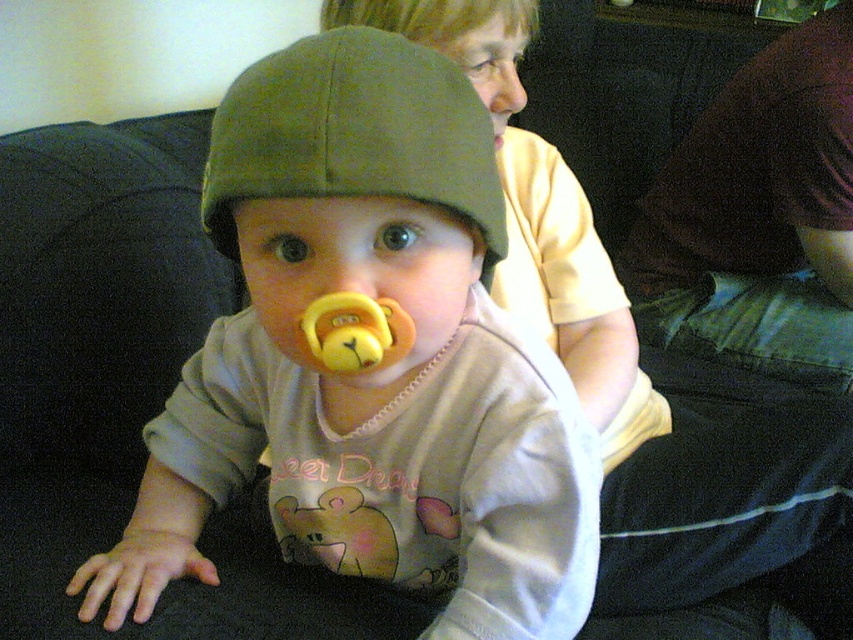
Question: Does light beige shirt at upper center have a lesser width compared to green felt hat at center?

Choices:
 (A) no
 (B) yes

Answer: (A)

Question: Estimate the real-world distances between objects in this image. Which object is farther from the matte green hat at center?

Choices:
 (A) yellow rubber pacifier at center
 (B) light beige shirt at upper center

Answer: (B)

Question: Estimate the real-world distances between objects in this image. Which object is farther from the matte yellow pacifier at center?

Choices:
 (A) matte green hat at center
 (B) dark brown fabric at lower right
 (C) green felt hat at center
 (D) light beige shirt at upper center

Answer: (B)

Question: Does matte green hat at center come behind light beige shirt at upper center?

Choices:
 (A) yes
 (B) no

Answer: (B)

Question: Which point is farther to the camera?

Choices:
 (A) (810, 310)
 (B) (598, 584)
 (C) (227, 97)
 (D) (366, 436)

Answer: (A)

Question: Is yellow rubber pacifier at center above matte yellow pacifier at center?

Choices:
 (A) yes
 (B) no

Answer: (B)